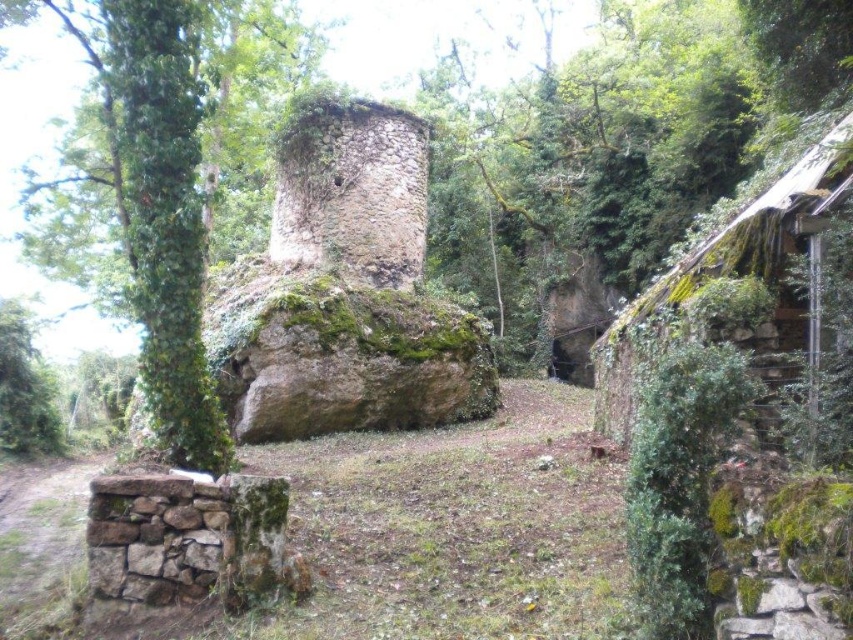
Question: Does mossy stone ruins at center lie behind green mossy stone hut at right?

Choices:
 (A) yes
 (B) no

Answer: (A)

Question: Can you confirm if green mossy tree at center-left is positioned to the right of green mossy stone hut at right?

Choices:
 (A) no
 (B) yes

Answer: (A)

Question: Can you confirm if green mossy tree at center-left is positioned above mossy stone ruins at center?

Choices:
 (A) no
 (B) yes

Answer: (B)

Question: Which object is farther from the camera taking this photo?

Choices:
 (A) mossy stone ruins at center
 (B) green mossy tree at center-left
 (C) green mossy stone hut at right

Answer: (A)

Question: Which object appears farthest from the camera in this image?

Choices:
 (A) green mossy stone hut at right
 (B) green mossy tree at center-left

Answer: (B)

Question: Which of the following is the closest to the observer?

Choices:
 (A) mossy stone ruins at center
 (B) green mossy tree at center-left
 (C) green mossy stone hut at right

Answer: (C)